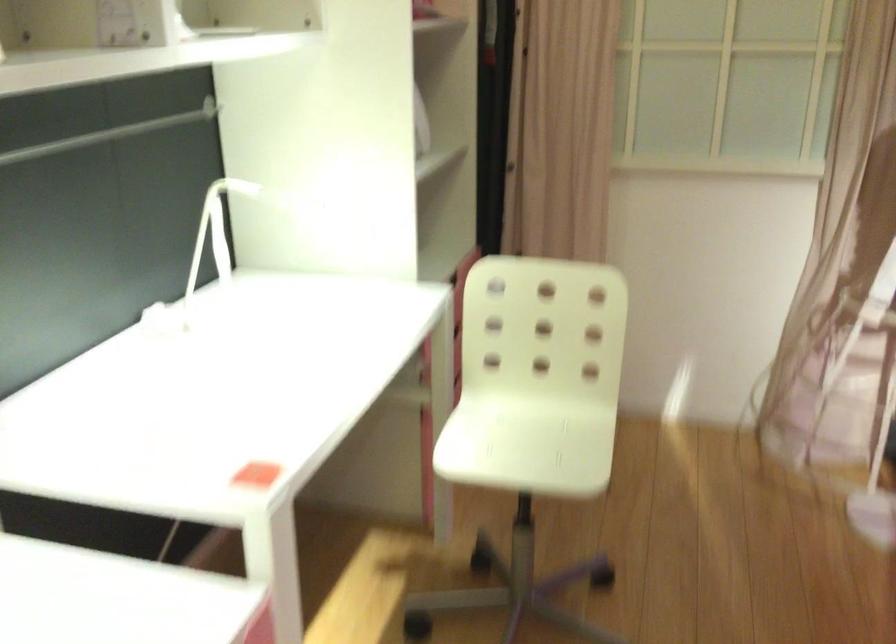
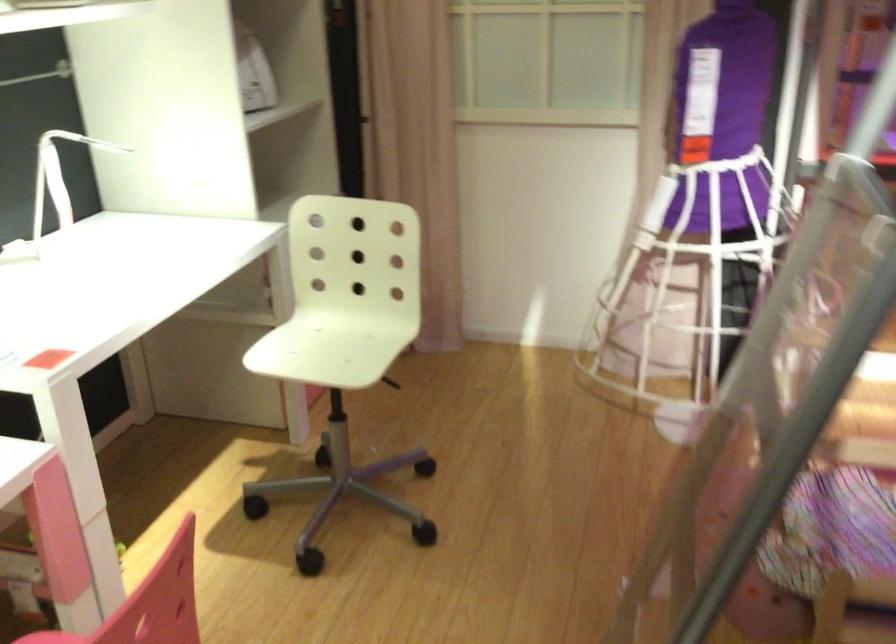
Where in the second image is the point corresponding to pixel 527 438 from the first image?

(331, 345)